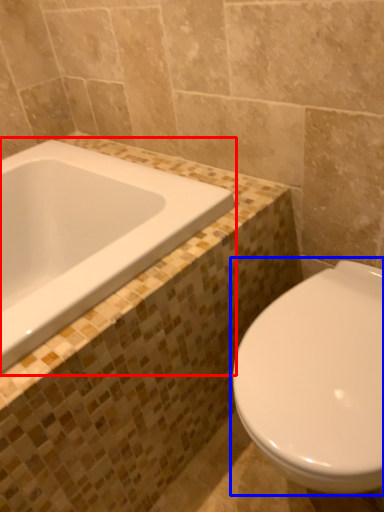
Question: Which object appears farthest to the camera in this image, bathtub (highlighted by a red box) or toilet (highlighted by a blue box)?

Choices:
 (A) bathtub
 (B) toilet

Answer: (A)